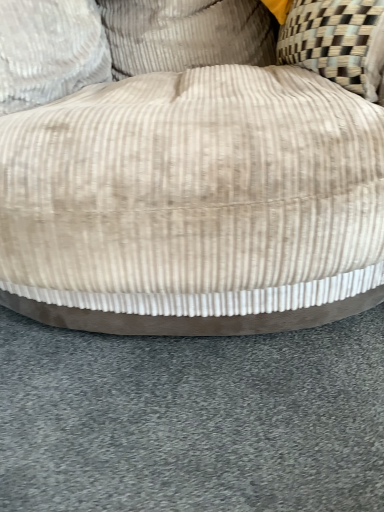
Describe the element at coordinates (49, 51) in the screenshot. The image size is (384, 512). I see `beige corduroy pillow at upper left, marked as the 1th pillow in a left-to-right arrangement` at that location.

In the scene shown: How much space does beige corduroy pillow at upper left, marked as the 1th pillow in a left-to-right arrangement, occupy vertically?

beige corduroy pillow at upper left, marked as the 1th pillow in a left-to-right arrangement, is 8.80 inches tall.

Locate an element on the screen. The height and width of the screenshot is (512, 384). beige corduroy ottoman at center is located at coordinates point(196,185).

Is beige corduroy ottoman at center oriented away from beige corduroy pillow at upper left, the 2th pillow from the right?

No, beige corduroy pillow at upper left, the 2th pillow from the right, is not at the back of beige corduroy ottoman at center.

Are beige corduroy ottoman at center and beige corduroy pillow at upper left, marked as the 1th pillow in a left-to-right arrangement, far apart?

No, beige corduroy ottoman at center is not far away from beige corduroy pillow at upper left, marked as the 1th pillow in a left-to-right arrangement.

From the image's perspective, which pillow is the 1st one above the beige corduroy ottoman at center? Please provide its 2D coordinates.

[(49, 51)]

Considering the sizes of objects beige corduroy pillow at upper left, marked as the 1th pillow in a left-to-right arrangement, and beige corduroy pillow at upper center, the 2th pillow from the left, in the image provided, who is bigger, beige corduroy pillow at upper left, marked as the 1th pillow in a left-to-right arrangement, or beige corduroy pillow at upper center, the 2th pillow from the left,?

beige corduroy pillow at upper center, the 2th pillow from the left.

From the image's perspective, who appears lower, beige corduroy pillow at upper left, the 2th pillow from the right, or beige corduroy pillow at upper center, the 2th pillow from the left?

beige corduroy pillow at upper left, the 2th pillow from the right, is shown below in the image.

Can you tell me how much beige corduroy pillow at upper left, the 2th pillow from the right, and beige corduroy pillow at upper center, the 2th pillow from the left, differ in facing direction?

The facing directions of beige corduroy pillow at upper left, the 2th pillow from the right, and beige corduroy pillow at upper center, the 2th pillow from the left, are 86.7 degrees apart.

Considering the relative sizes of beige corduroy pillow at upper left, the 2th pillow from the right, and beige corduroy pillow at upper center, the 2th pillow from the left, in the image provided, is beige corduroy pillow at upper left, the 2th pillow from the right, thinner than beige corduroy pillow at upper center, the 2th pillow from the left,?

No.

Considering the relative positions of beige corduroy pillow at upper center, the 2th pillow from the left, and beige corduroy ottoman at center in the image provided, is beige corduroy pillow at upper center, the 2th pillow from the left, to the right of beige corduroy ottoman at center from the viewer's perspective?

In fact, beige corduroy pillow at upper center, the 2th pillow from the left, is to the left of beige corduroy ottoman at center.

From the image's perspective, is beige corduroy pillow at upper center, the 2th pillow from the left, located beneath beige corduroy ottoman at center?

No, from the image's perspective, beige corduroy pillow at upper center, the 2th pillow from the left, is not below beige corduroy ottoman at center.

Would you say beige corduroy pillow at upper center, positioned as the 1th pillow in right-to-left order, contains beige corduroy ottoman at center?

No, beige corduroy ottoman at center is located outside of beige corduroy pillow at upper center, positioned as the 1th pillow in right-to-left order.

Are beige corduroy pillow at upper center, the 2th pillow from the left, and beige corduroy ottoman at center beside each other?

No, beige corduroy pillow at upper center, the 2th pillow from the left, is not next to beige corduroy ottoman at center.

Which is closer to the camera, (353,94) or (261,14)?

Point (353,94) appears to be closer to the viewer than point (261,14).

In terms of size, does beige corduroy ottoman at center appear bigger or smaller than beige corduroy pillow at upper center, the 2th pillow from the left?

In the image, beige corduroy ottoman at center appears to be larger than beige corduroy pillow at upper center, the 2th pillow from the left.

Is beige corduroy ottoman at center oriented away from beige corduroy pillow at upper center, the 2th pillow from the left?

Yes.

Who is taller, beige corduroy ottoman at center or beige corduroy pillow at upper center, positioned as the 1th pillow in right-to-left order?

beige corduroy ottoman at center is taller.

Can you confirm if beige corduroy pillow at upper left, marked as the 1th pillow in a left-to-right arrangement, is positioned to the left of beige corduroy ottoman at center?

Indeed, beige corduroy pillow at upper left, marked as the 1th pillow in a left-to-right arrangement, is positioned on the left side of beige corduroy ottoman at center.

How distant is beige corduroy pillow at upper left, the 2th pillow from the right, from beige corduroy ottoman at center?

They are 15.92 inches apart.

Is beige corduroy pillow at upper left, the 2th pillow from the right, placed right next to beige corduroy ottoman at center?

No, beige corduroy pillow at upper left, the 2th pillow from the right, is not with beige corduroy ottoman at center.

Is beige corduroy pillow at upper left, the 2th pillow from the right, not within beige corduroy ottoman at center?

No, beige corduroy pillow at upper left, the 2th pillow from the right, is inside or overlapping with beige corduroy ottoman at center.

From the image's perspective, which is below, beige corduroy pillow at upper center, positioned as the 1th pillow in right-to-left order, or beige corduroy pillow at upper left, marked as the 1th pillow in a left-to-right arrangement?

beige corduroy pillow at upper left, marked as the 1th pillow in a left-to-right arrangement.

From a real-world perspective, does beige corduroy pillow at upper center, the 2th pillow from the left, stand above beige corduroy pillow at upper left, the 2th pillow from the right?

No, from a real-world perspective, beige corduroy pillow at upper center, the 2th pillow from the left, is not on top of beige corduroy pillow at upper left, the 2th pillow from the right.

Which of these two, beige corduroy pillow at upper center, positioned as the 1th pillow in right-to-left order, or beige corduroy pillow at upper left, marked as the 1th pillow in a left-to-right arrangement, is smaller?

beige corduroy pillow at upper left, marked as the 1th pillow in a left-to-right arrangement, is smaller.

Where is `furniture in front of the beige corduroy pillow at upper left, the 2th pillow from the right`? The image size is (384, 512). furniture in front of the beige corduroy pillow at upper left, the 2th pillow from the right is located at coordinates (196, 185).

Image resolution: width=384 pixels, height=512 pixels. Find the location of `pillow behind the beige corduroy pillow at upper left, the 2th pillow from the right`. pillow behind the beige corduroy pillow at upper left, the 2th pillow from the right is located at coordinates (187, 34).

Based on their spatial positions, is beige corduroy pillow at upper left, the 2th pillow from the right, or beige corduroy ottoman at center closer to beige corduroy pillow at upper center, the 2th pillow from the left?

beige corduroy pillow at upper left, the 2th pillow from the right, lies closer to beige corduroy pillow at upper center, the 2th pillow from the left, than the other object.

Considering their positions, is beige corduroy ottoman at center positioned further to beige corduroy pillow at upper center, the 2th pillow from the left, than beige corduroy pillow at upper left, the 2th pillow from the right?

Among the two, beige corduroy ottoman at center is located further to beige corduroy pillow at upper center, the 2th pillow from the left.

When comparing their distances from beige corduroy ottoman at center, does beige corduroy pillow at upper center, the 2th pillow from the left, or beige corduroy pillow at upper left, the 2th pillow from the right, seem further?

beige corduroy pillow at upper center, the 2th pillow from the left, is further to beige corduroy ottoman at center.

From the image, which object appears to be farther from beige corduroy pillow at upper left, marked as the 1th pillow in a left-to-right arrangement, beige corduroy ottoman at center or beige corduroy pillow at upper center, positioned as the 1th pillow in right-to-left order?

The object further to beige corduroy pillow at upper left, marked as the 1th pillow in a left-to-right arrangement, is beige corduroy ottoman at center.

Which object lies nearer to the anchor point beige corduroy ottoman at center, beige corduroy pillow at upper left, the 2th pillow from the right, or beige corduroy pillow at upper center, the 2th pillow from the left?

beige corduroy pillow at upper left, the 2th pillow from the right.

Based on their spatial positions, is beige corduroy pillow at upper center, positioned as the 1th pillow in right-to-left order, or beige corduroy ottoman at center closer to beige corduroy pillow at upper left, marked as the 1th pillow in a left-to-right arrangement?

Based on the image, beige corduroy pillow at upper center, positioned as the 1th pillow in right-to-left order, appears to be nearer to beige corduroy pillow at upper left, marked as the 1th pillow in a left-to-right arrangement.

In order to click on pillow positioned between beige corduroy ottoman at center and beige corduroy pillow at upper center, positioned as the 1th pillow in right-to-left order, from near to far in this screenshot , I will do `click(49, 51)`.